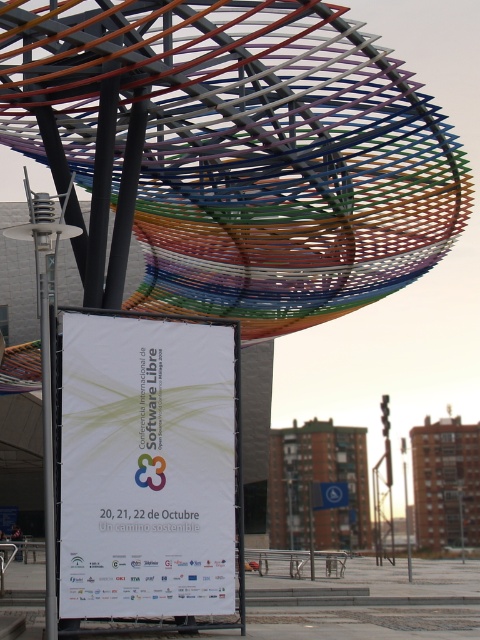
Question: Is metallic wire mesh canopy at upper center positioned in front of white paper at center?

Choices:
 (A) no
 (B) yes

Answer: (A)

Question: Which of the following is the closest to the observer?

Choices:
 (A) (212, 413)
 (B) (255, 38)

Answer: (A)

Question: Does metallic wire mesh canopy at upper center have a larger size compared to white paper at center?

Choices:
 (A) no
 (B) yes

Answer: (B)

Question: Is metallic wire mesh canopy at upper center further to camera compared to white paper at center?

Choices:
 (A) yes
 (B) no

Answer: (A)

Question: Which point is farther from the camera taking this photo?

Choices:
 (A) click(x=44, y=8)
 (B) click(x=96, y=509)

Answer: (A)